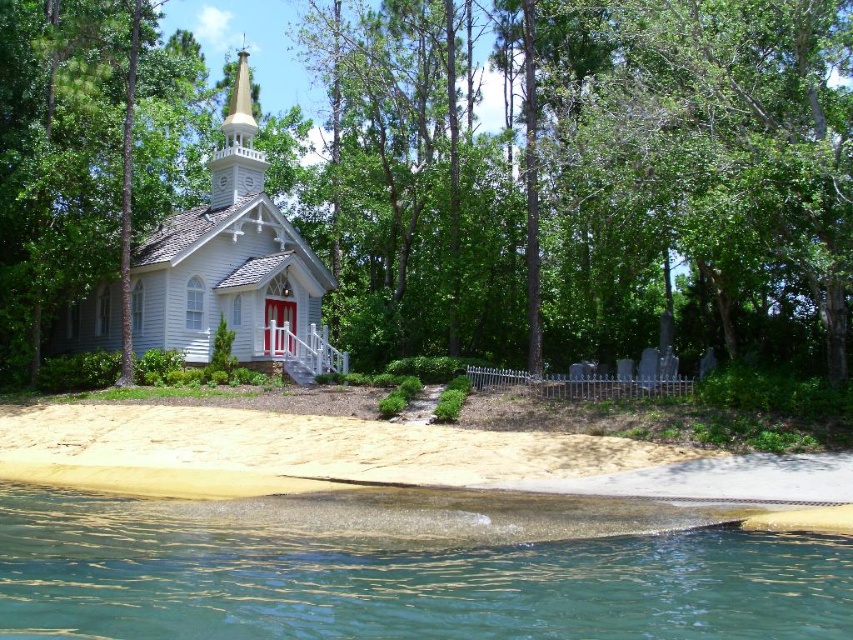
Who is positioned more to the right, green leafy tree at center or white wooden church at center?

Positioned to the right is green leafy tree at center.

The image size is (853, 640). Describe the element at coordinates (582, 176) in the screenshot. I see `green leafy tree at center` at that location.

Based on the photo, who is more distant from viewer, [408,102] or [83,310]?

The point [408,102] is behind.

Locate an element on the screen. This screenshot has height=640, width=853. green leafy tree at center is located at coordinates (582, 176).

Which is in front, point (801, 634) or point (699, 464)?

Positioned in front is point (801, 634).

Who is lower down, clear glass water at lower left or sandy shore at lower left?

clear glass water at lower left

You are a GUI agent. You are given a task and a screenshot of the screen. Output one action in this format:
    pyautogui.click(x=<x>, y=<y>)
    Task: Click on the clear glass water at lower left
    
    Given the screenshot: What is the action you would take?
    pyautogui.click(x=401, y=582)

Who is lower down, sandy shore at lower left or white wooden church at center?

Positioned lower is sandy shore at lower left.

Does sandy shore at lower left have a smaller size compared to white wooden church at center?

Yes.

At what (x,y) coordinates should I click in order to perform the action: click on sandy shore at lower left. Please return your answer as a coordinate pair (x, y). The image size is (853, 640). Looking at the image, I should click on (402, 454).

Locate an element on the screen. The image size is (853, 640). sandy shore at lower left is located at coordinates (402, 454).